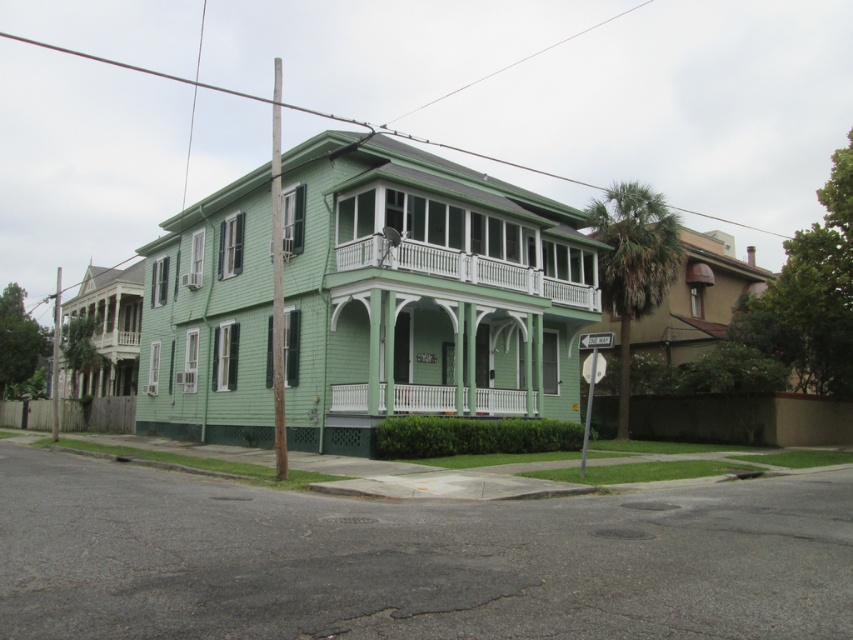
You are a delivery person trying to park your van on the sidewalk in front of the house. The van is 2 meters wide. The white wooden porch at upper center and the white painted wood porch at center are both in your path. Which porch has a wider space to accommodate the van?

The white wooden porch at upper center has a wider space than the white painted wood porch at center, so it can accommodate the van better.

You are a delivery person standing at the utility pole in the foreground. You need to deliver a package to the white wooden porch at upper center. According to the coordinates provided, in which direction should you walk from the utility pole to reach the porch?

The white wooden porch at upper center is located at coordinates point (463, 269). Since the utility pole is in the foreground, you should walk towards the center of the image to reach the porch.

You are a painter who needs to reach the highest point of the white wooden porch at upper center and the white painted wood porch at center. Which one will require a taller ladder?

The white wooden porch at upper center is much taller than the white painted wood porch at center, so you will need a taller ladder to reach the highest point of the white wooden porch at upper center.